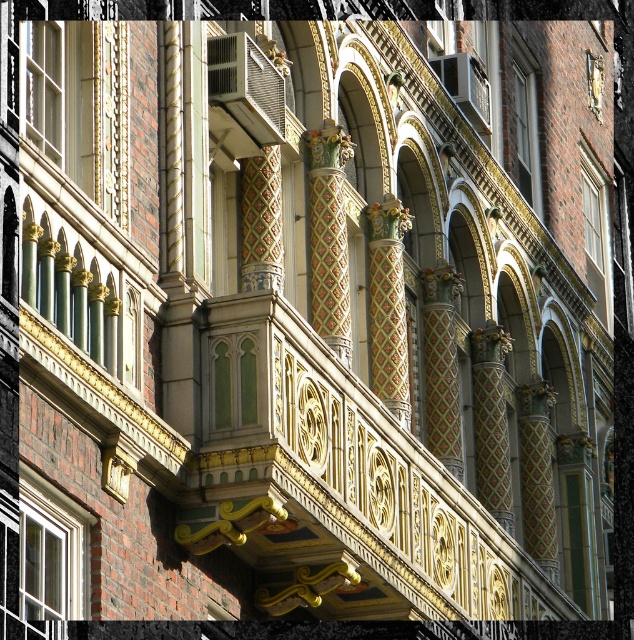
You are an architect examining the building facade and need to install a new light fixture. The existing matte glass window at upper center is located at coordinates point 0.191, 0.826. If you want to place the light fixture 0.05 units to the right and 0.03 units below the window, what are the new coordinates for the light fixture?

The new coordinates for the light fixture would be calculated by adding 0.05 to the x coordinate and subtracting 0.03 from the y coordinate of the matte glass window at upper center. The original coordinates are (522, 122). Adding 0.05 to 0.191 gives 0.241, and subtracting 0.03 from 0.826 gives 0.796. Therefore, the new coordinates are (503, 154).

You are an architect examining this historic building facade. You notice the white glossy window at lower left and the matte glass window at upper right. Which window is located below the other?

The white glossy window at lower left is positioned under the matte glass window at upper right.

You are an architect analyzing the building facade. You need to determine the exact position of the matte glass window at upper left. What are its coordinates?

The matte glass window at upper left is located at coordinates point (x=79, y=104).